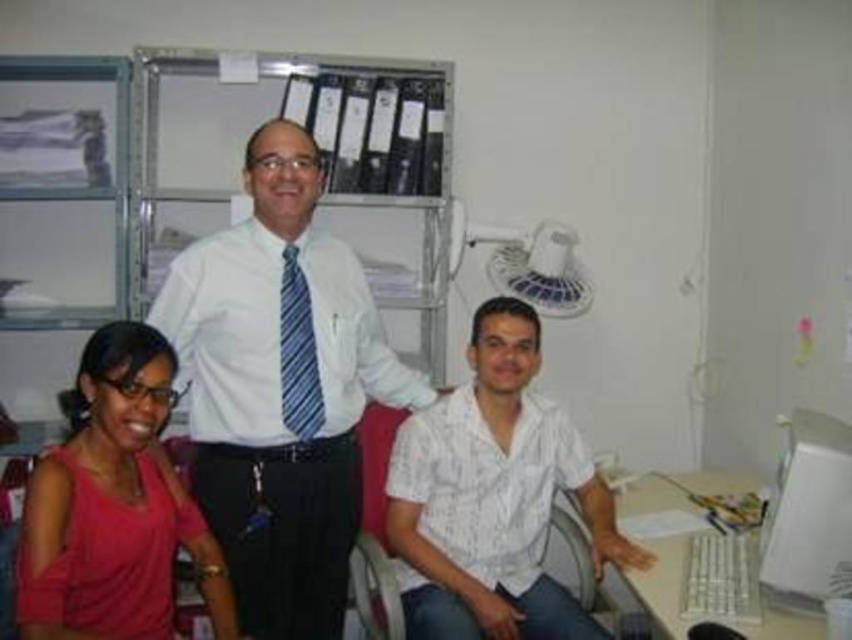
You are a security guard checking the lanyards of people in the office. You notice the white smooth shirt at center and the pink matte shirt at lower left. Which person is standing closer to the metal shelving unit?

The white smooth shirt at center is positioned over the pink matte shirt at lower left, meaning the white smooth shirt at center is closer to the metal shelving unit.

In the scene shown: You are a security guard checking IDs. You see the pink matte shirt at lower left and the blue striped tie at center. Which one is nearer to you?

The pink matte shirt at lower left is closer to the viewer than the blue striped tie at center.

You are standing in an office and need to locate the white plastic monitor at right. According to the coordinates provided, where would you look to find it?

The white plastic monitor at right is located at point coordinates (807, 513).